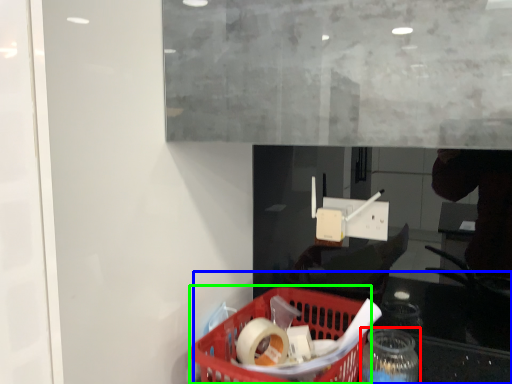
Question: Considering the real-world distances, which object is closest to bottle (highlighted by a red box)? table (highlighted by a blue box) or basket (highlighted by a green box).

Choices:
 (A) table
 (B) basket

Answer: (A)